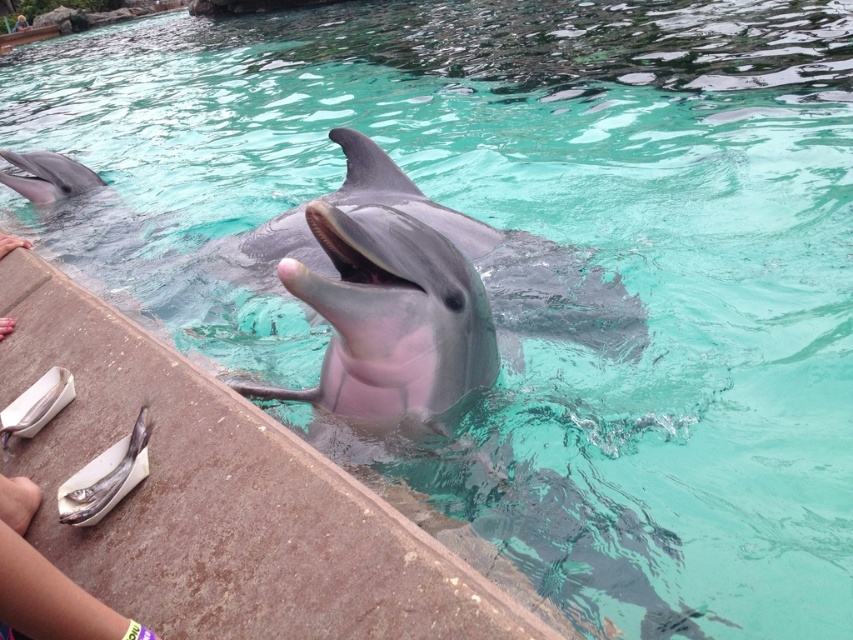
Based on the coordinates provided, which object in the scene is located at point (421, 298)?

The smooth gray dolphin at center is located at point (421, 298).

You are a marine biologist observing the dolphin and the two fish in the scene. Which fish is closer to the dolphin, the skinny fish at lower left or the shiny silver fish at lower left?

The skinny fish at lower left is closer to the dolphin because it is positioned in front of the shiny silver fish at lower left.